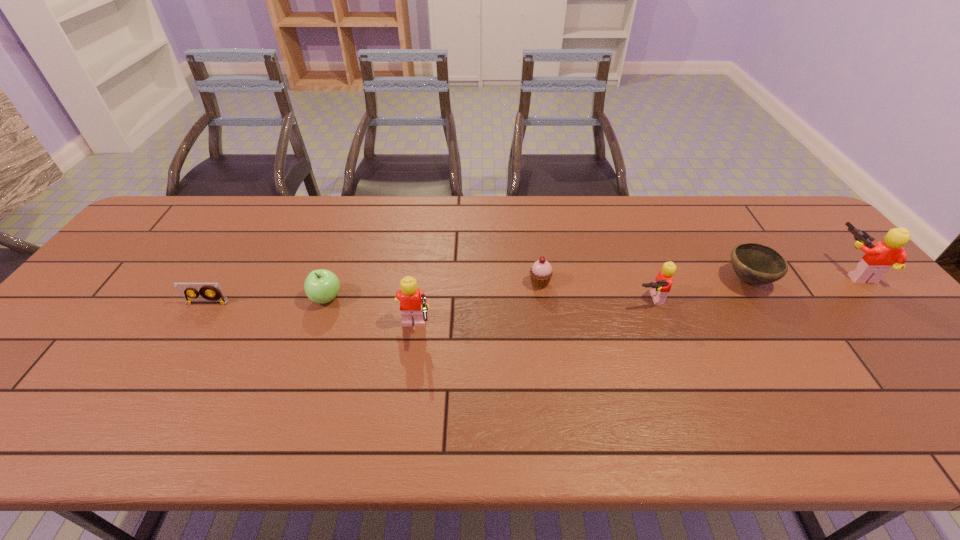
Identify the location of object at the right edge. The width and height of the screenshot is (960, 540). (878, 259).

At what (x,y) coordinates should I click in order to perform the action: click on vacant area at the far edge of the desktop. Please return your answer as a coordinate pair (x, y). The width and height of the screenshot is (960, 540). Looking at the image, I should click on (380, 207).

In the image, there is a desktop. Find the location of `free space at the near edge`. free space at the near edge is located at coordinates (464, 372).

The width and height of the screenshot is (960, 540). What are the coordinates of `blank space at the left edge` in the screenshot? It's located at (120, 313).

I want to click on vacant position at the right edge of the desktop, so click(x=840, y=262).

Find the location of a particular element. The height and width of the screenshot is (540, 960). unoccupied area between the apple and the shortest Lego is located at coordinates (488, 299).

The width and height of the screenshot is (960, 540). Find the location of `vacant area that lies between the leftmost Lego and the fourth object from right to left`. vacant area that lies between the leftmost Lego and the fourth object from right to left is located at coordinates (477, 307).

Identify the location of unoccupied position between the cupcake and the bowl. (644, 281).

Where is `free spot between the fourth object from left to right and the bowl`? The image size is (960, 540). free spot between the fourth object from left to right and the bowl is located at coordinates (644, 281).

Identify the location of free space between the fifth object from left to right and the shortest object. Image resolution: width=960 pixels, height=540 pixels. (428, 301).